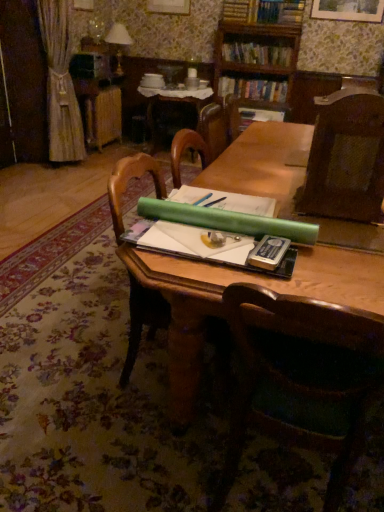
Find the location of a particular element. This screenshot has height=512, width=384. vacant space to the left of brown textured chair at right, which is counted as the 2th chair, starting from the bottom is located at coordinates (282, 201).